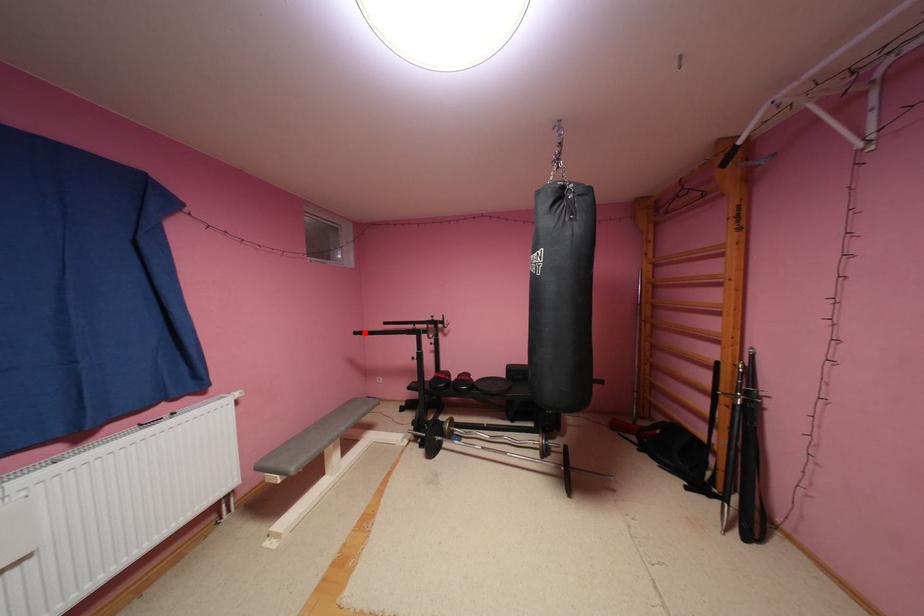
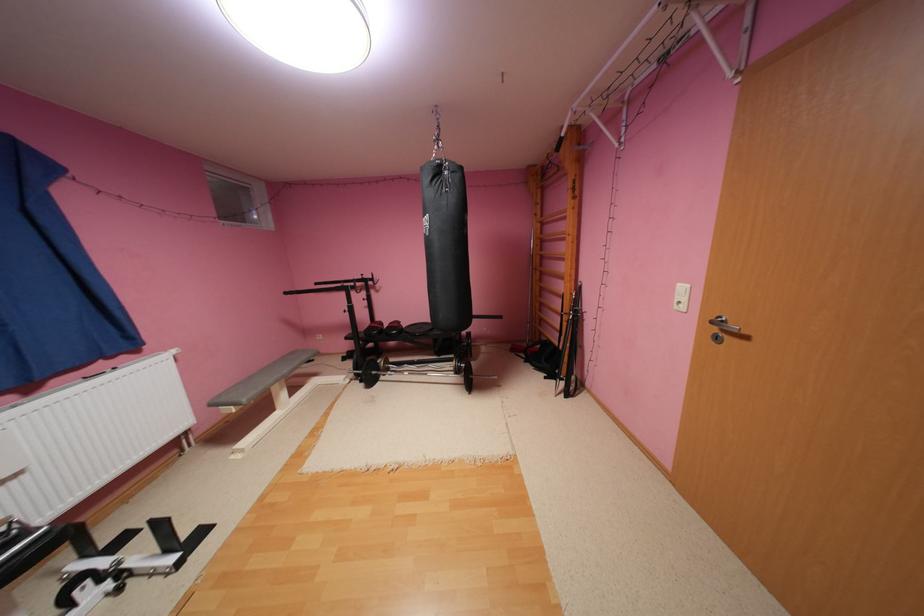
In the second image, find the point that corresponds to the highlighted location in the first image.

(295, 293)